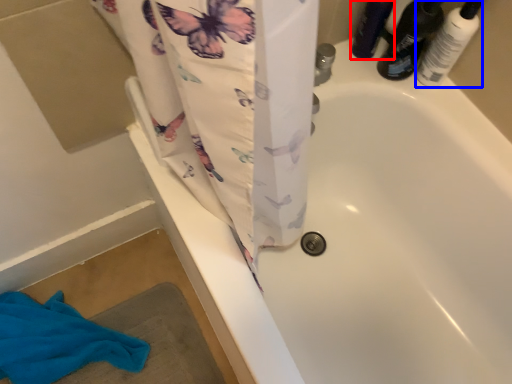
Question: Which object appears farthest to the camera in this image, toiletry (highlighted by a red box) or toiletry (highlighted by a blue box)?

Choices:
 (A) toiletry
 (B) toiletry

Answer: (A)